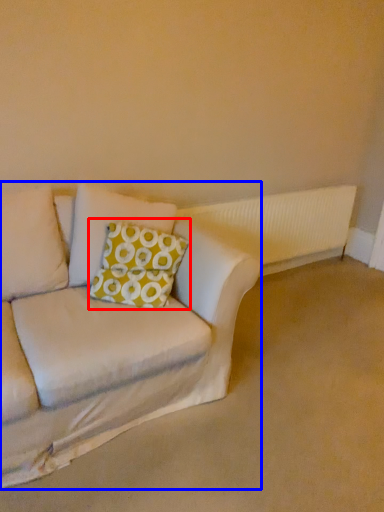
Question: Which object appears closest to the camera in this image, throw pillow (highlighted by a red box) or studio couch (highlighted by a blue box)?

Choices:
 (A) throw pillow
 (B) studio couch

Answer: (B)